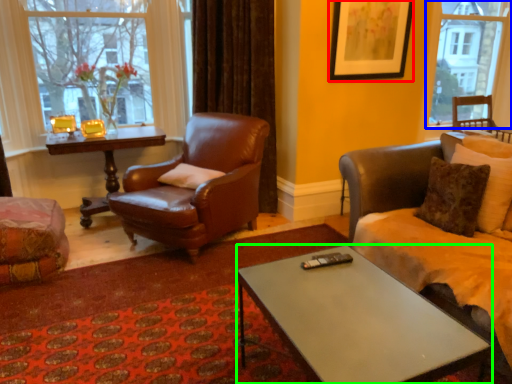
Question: Estimate the real-world distances between objects in this image. Which object is farther from picture frame (highlighted by a red box), window (highlighted by a blue box) or coffee table (highlighted by a green box)?

Choices:
 (A) window
 (B) coffee table

Answer: (B)